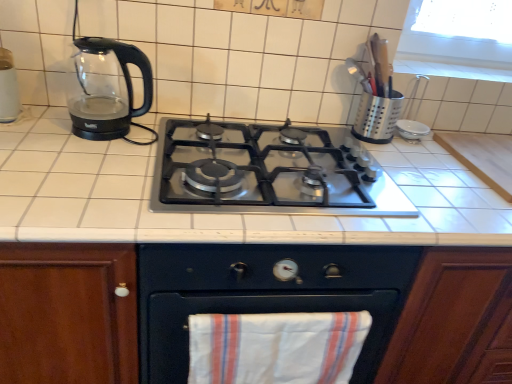
Question: Is transparent glass kettle at left bigger or smaller than white tile countertop at center?

Choices:
 (A) big
 (B) small

Answer: (B)

Question: From a real-world perspective, is transparent glass kettle at left physically located above or below white tile countertop at center?

Choices:
 (A) above
 (B) below

Answer: (A)

Question: Estimate the real-world distances between objects in this image. Which object is closer to the transparent glass kettle at left?

Choices:
 (A) white cotton beach towel at lower center
 (B) black glass gas stove at center
 (C) white tile countertop at center
 (D) wooden cabinet at center
 (E) silver metallic utensil holder at upper right

Answer: (C)

Question: Estimate the real-world distances between objects in this image. Which object is farther from the silver metallic utensil holder at upper right?

Choices:
 (A) transparent glass kettle at left
 (B) wooden cabinet at center
 (C) black glass gas stove at center
 (D) white cotton beach towel at lower center
 (E) white tile countertop at center

Answer: (A)